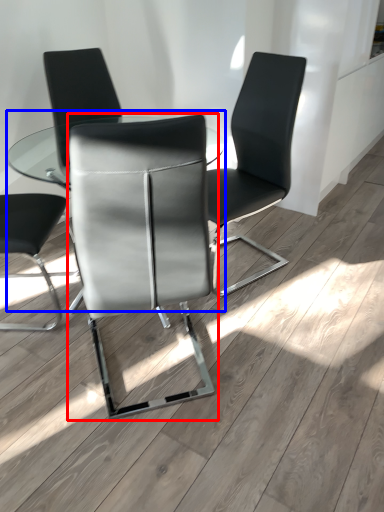
Question: Which object is closer to the camera taking this photo, chair (highlighted by a red box) or table (highlighted by a blue box)?

Choices:
 (A) chair
 (B) table

Answer: (A)